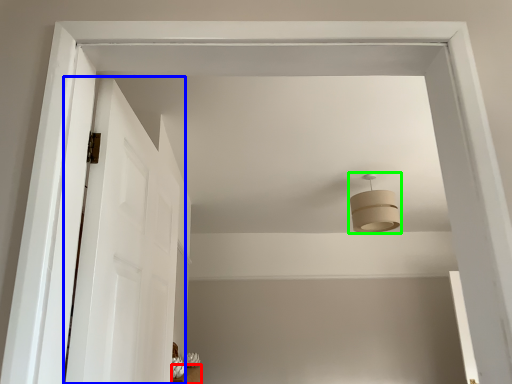
Question: Which is farther away from furniture (highlighted by a red box)? door (highlighted by a blue box) or fixture (highlighted by a green box)?

Choices:
 (A) door
 (B) fixture

Answer: (A)